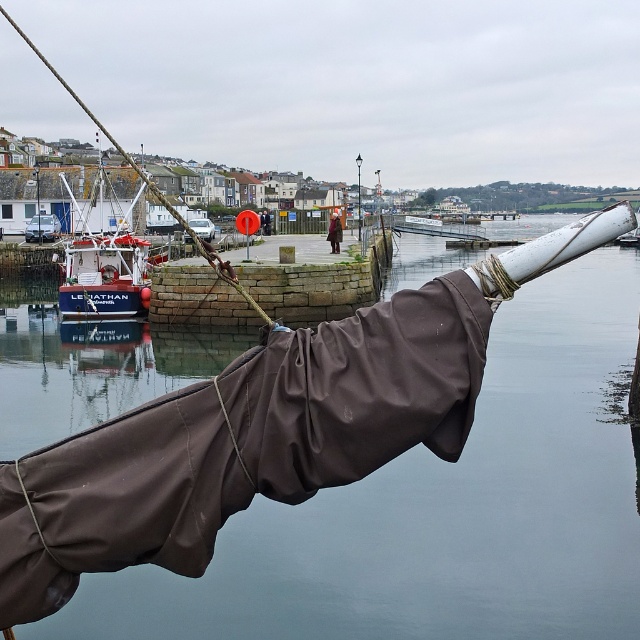
Between point (356, 170) and point (262, 225), which one is positioned in front?

Point (262, 225)

Does point (358, 186) come in front of point (264, 228)?

No, it is behind (264, 228).

You are a GUI agent. You are given a task and a screenshot of the screen. Output one action in this format:
    pyautogui.click(x=<x>, y=<y>)
    Task: Click on the white plastic pole at center
    
    Given the screenshot: What is the action you would take?
    pyautogui.click(x=358, y=196)

Does brown fabric coat at center appear on the left side of white plastic pole at center?

Correct, you'll find brown fabric coat at center to the left of white plastic pole at center.

Between point (330, 241) and point (356, 198), which one is positioned in front?

Point (330, 241) is more forward.

Find the location of a particular element. This screenshot has height=640, width=640. brown fabric coat at center is located at coordinates (333, 232).

Is transparent water at center further to camera compared to blue matte fishing boat at left?

No, transparent water at center is in front of blue matte fishing boat at left.

What do you see at coordinates (435, 513) in the screenshot? The width and height of the screenshot is (640, 640). I see `transparent water at center` at bounding box center [435, 513].

Find the location of a particular element. This screenshot has height=640, width=640. transparent water at center is located at coordinates (435, 513).